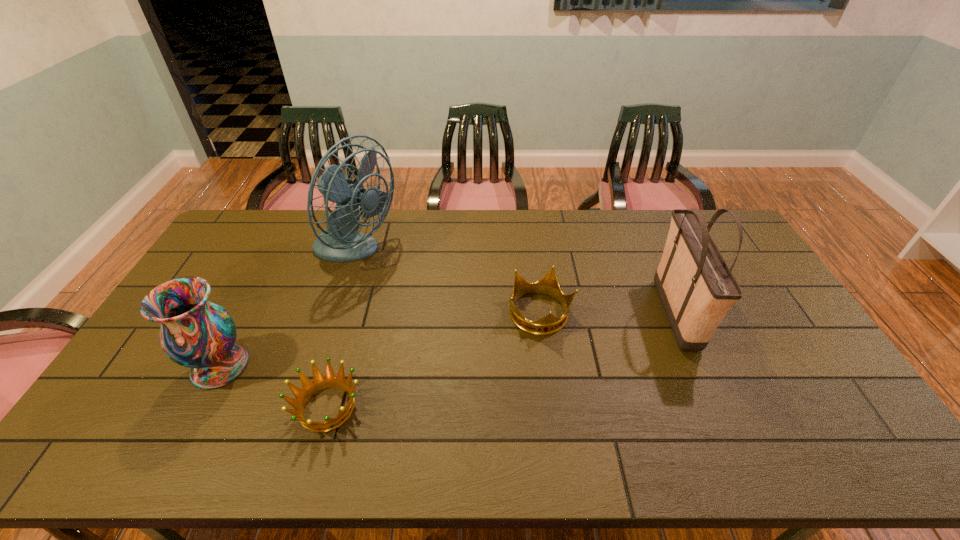
At what (x,y) coordinates should I click in order to perform the action: click on blank space at the far left corner. Please return your answer as a coordinate pair (x, y). The width and height of the screenshot is (960, 540). Looking at the image, I should click on pos(247,218).

The height and width of the screenshot is (540, 960). What are the coordinates of `free space at the near left corner of the desktop` in the screenshot? It's located at (137, 447).

Where is `free spot between the third shortest object and the fourth tallest object`? This screenshot has width=960, height=540. free spot between the third shortest object and the fourth tallest object is located at coordinates (380, 340).

The height and width of the screenshot is (540, 960). I want to click on free area in between the left crown and the farther crown, so [434, 361].

The height and width of the screenshot is (540, 960). In order to click on free spot between the farther crown and the rightmost object in this screenshot , I will do `click(608, 314)`.

The image size is (960, 540). I want to click on vacant area that lies between the tallest object and the taller crown, so click(x=447, y=284).

The height and width of the screenshot is (540, 960). I want to click on free space between the shorter crown and the tallest object, so click(x=341, y=330).

Find the location of a particular element. The image size is (960, 540). vacant space that's between the shorter crown and the third shortest object is located at coordinates (274, 387).

What are the coordinates of `blank region between the farther crown and the nearer crown` in the screenshot? It's located at (434, 361).

At what (x,y) coordinates should I click in order to perform the action: click on vacant space that's between the leftmost object and the left crown. Please return your answer as a coordinate pair (x, y). Looking at the image, I should click on (274, 387).